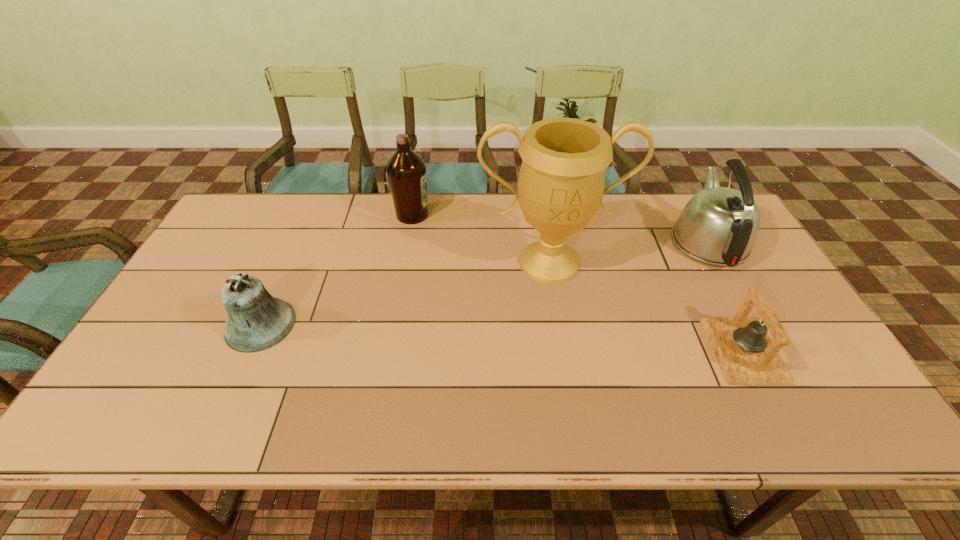
At what (x,y) coordinates should I click in order to perform the action: click on vacant area that lies between the kettle and the fourth tallest object. Please return your answer as a coordinate pair (x, y). The width and height of the screenshot is (960, 540). Looking at the image, I should click on (484, 283).

This screenshot has height=540, width=960. In order to click on free space between the kettle and the tallest object in this screenshot , I will do `click(629, 252)`.

Find the location of a particular element. This screenshot has height=540, width=960. the fourth closest object to the kettle is located at coordinates pyautogui.click(x=256, y=321).

Select which object is the closest to the kettle. Please provide its 2D coordinates. Your answer should be formatted as a tuple, i.e. [(x, y)], where the tuple contains the x and y coordinates of a point satisfying the conditions above.

[(747, 356)]

Where is `free point that satisfies the following two spatial constraints: 1. on the label of the right bell; 2. on the left side of the second object from left to right`? The height and width of the screenshot is (540, 960). free point that satisfies the following two spatial constraints: 1. on the label of the right bell; 2. on the left side of the second object from left to right is located at coordinates (388, 350).

Locate an element on the screen. free location that satisfies the following two spatial constraints: 1. on the label of the shortest object; 2. on the left side of the olive oil is located at coordinates (388, 350).

Find the location of a particular element. vacant space that satisfies the following two spatial constraints: 1. on the spout of the kettle; 2. on the label of the olive oil is located at coordinates (693, 215).